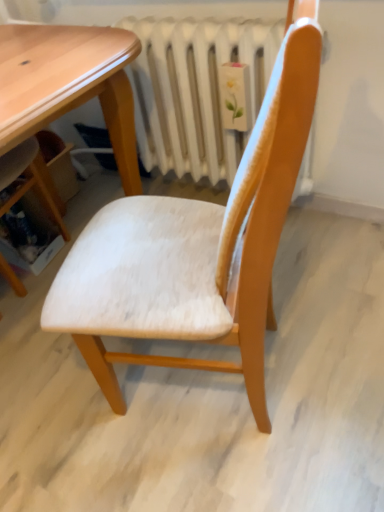
Where is `vacant area that lies in front of white fabric chair at center`? The image size is (384, 512). vacant area that lies in front of white fabric chair at center is located at coordinates (220, 478).